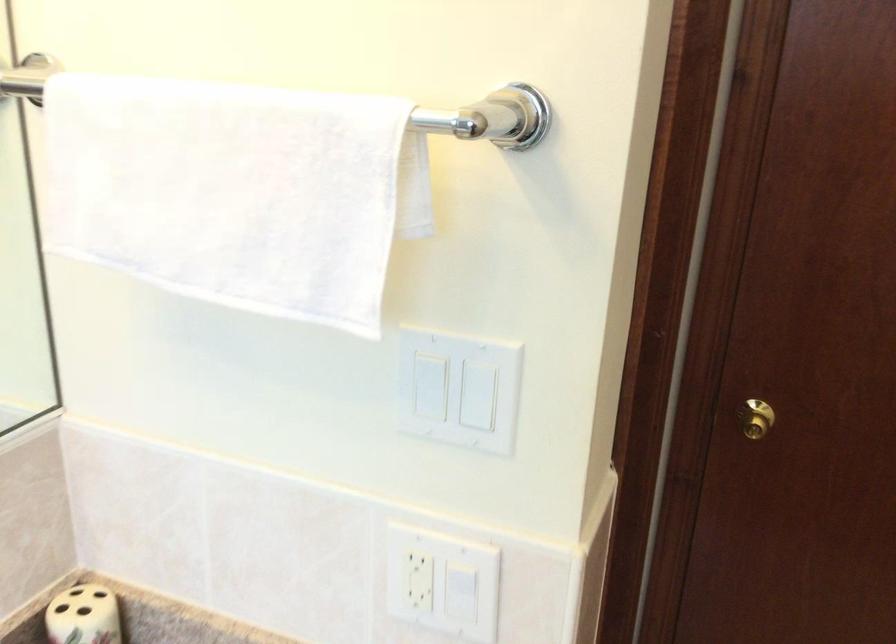
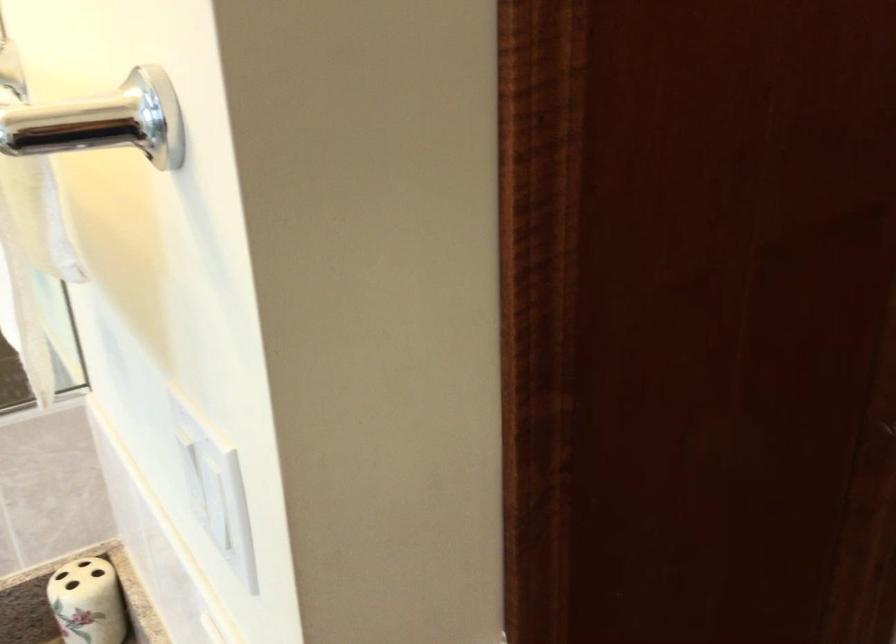
Question: The images are taken continuously from a first-person perspective. In which direction is your viewpoint rotating?

Choices:
 (A) Left
 (B) Right
 (C) Up
 (D) Down

Answer: (A)